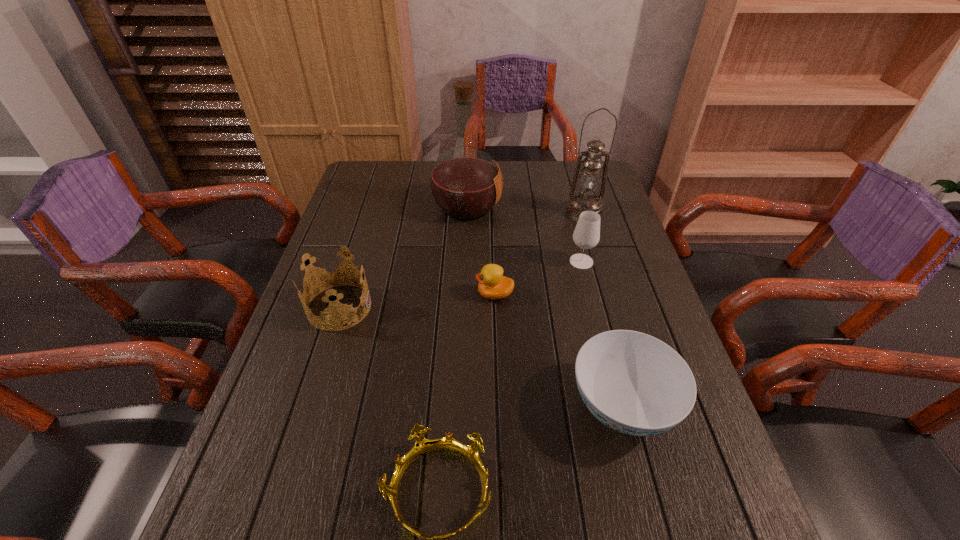
Find the location of `free location located on the back of the left crown`. free location located on the back of the left crown is located at coordinates (365, 226).

Find the location of `vacant space located on the back of the third shortest object`. vacant space located on the back of the third shortest object is located at coordinates (601, 326).

Locate an element on the screen. The width and height of the screenshot is (960, 540). free space located on the face of the duckling is located at coordinates (x=423, y=294).

Where is `free space located on the face of the duckling`? Image resolution: width=960 pixels, height=540 pixels. free space located on the face of the duckling is located at coordinates (x=345, y=294).

This screenshot has height=540, width=960. What are the coordinates of `free spot located on the face of the duckling` in the screenshot? It's located at (345, 294).

At what (x,y) coordinates should I click in order to perform the action: click on object that is positioned at the far edge. Please return your answer as a coordinate pair (x, y). Looking at the image, I should click on (466, 183).

The width and height of the screenshot is (960, 540). I want to click on object that is at the left edge, so click(336, 309).

The height and width of the screenshot is (540, 960). Identify the location of oil lamp located at the right edge. (589, 180).

Locate an element on the screen. glass positioned at the right edge is located at coordinates (586, 235).

At what (x,y) coordinates should I click in order to perform the action: click on chinaware situated at the right edge. Please return your answer as a coordinate pair (x, y). The image size is (960, 540). Looking at the image, I should click on (634, 383).